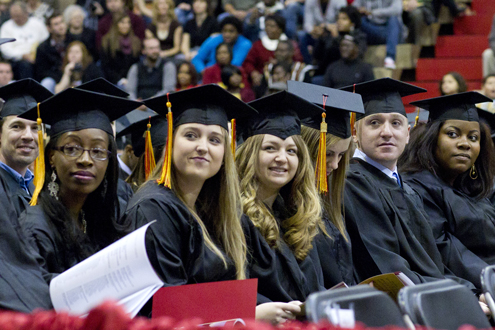
Find the location of a particular element. stairs is located at coordinates (439, 71), (459, 53), (475, 24), (486, 7), (430, 86).